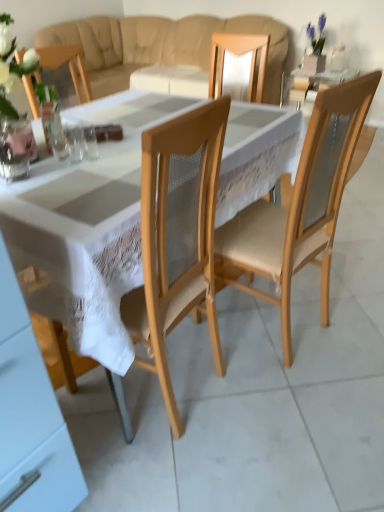
Find the location of `vacant area on the back side of clear glass cup at center, the third tableware positioned from the left`. vacant area on the back side of clear glass cup at center, the third tableware positioned from the left is located at coordinates (95, 140).